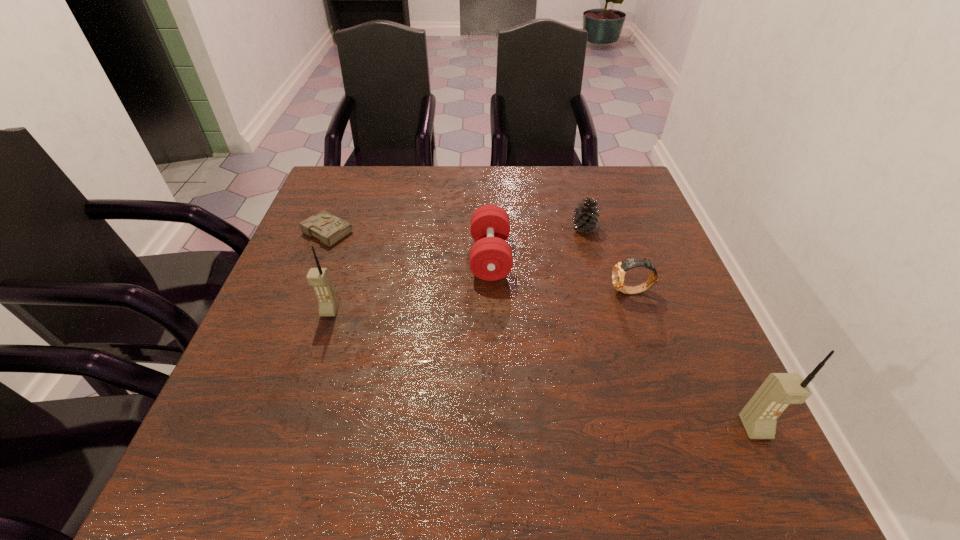
Where is `watch located in the right edge section of the desktop`? This screenshot has width=960, height=540. watch located in the right edge section of the desktop is located at coordinates (618, 273).

Where is `object located at the near right corner`? object located at the near right corner is located at coordinates (759, 417).

The width and height of the screenshot is (960, 540). Identify the location of vacant space at the far edge of the desktop. (516, 168).

Locate an element on the screen. This screenshot has width=960, height=540. blank space at the near edge of the desktop is located at coordinates (624, 411).

Image resolution: width=960 pixels, height=540 pixels. What are the coordinates of `vacant region at the left edge` in the screenshot? It's located at (312, 337).

You are a GUI agent. You are given a task and a screenshot of the screen. Output one action in this format:
    pyautogui.click(x=<x>, y=<y>)
    Task: Click on the free spot at the right edge of the desktop
    The width and height of the screenshot is (960, 540).
    Given the screenshot: What is the action you would take?
    pyautogui.click(x=668, y=256)

In the image, there is a desktop. What are the coordinates of `vacant space at the far left corner` in the screenshot? It's located at (360, 208).

Identify the location of vacant area at the near left corner of the desktop. The height and width of the screenshot is (540, 960). (238, 400).

Find the location of a particular element. This screenshot has height=540, width=960. vacant area at the far right corner is located at coordinates (591, 174).

Find the location of a particular element. vacant area that lies between the dumbbell and the tallest object is located at coordinates (623, 342).